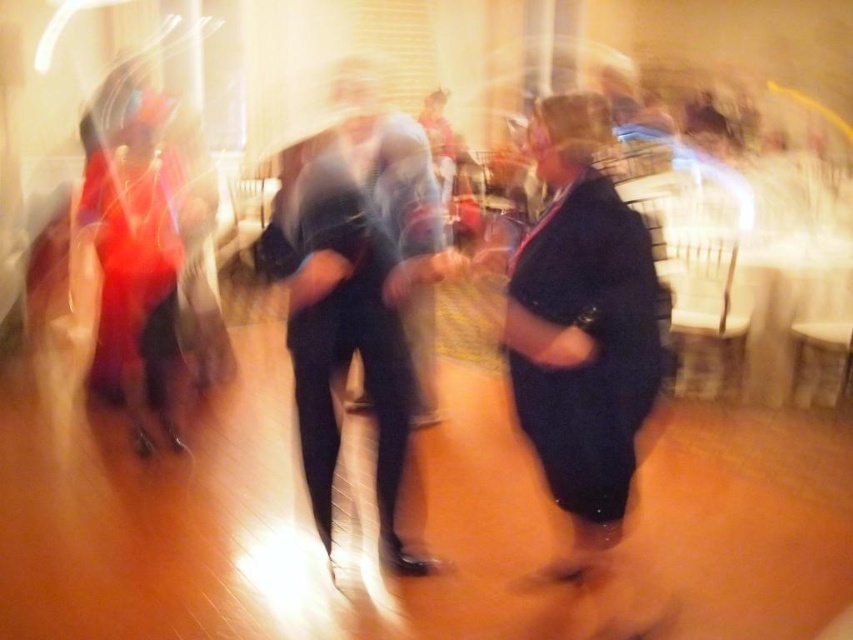
Which is more to the left, matte black suit at center or dark blue jeans at center?

matte black suit at center

Locate an element on the screen. This screenshot has height=640, width=853. matte black suit at center is located at coordinates (360, 289).